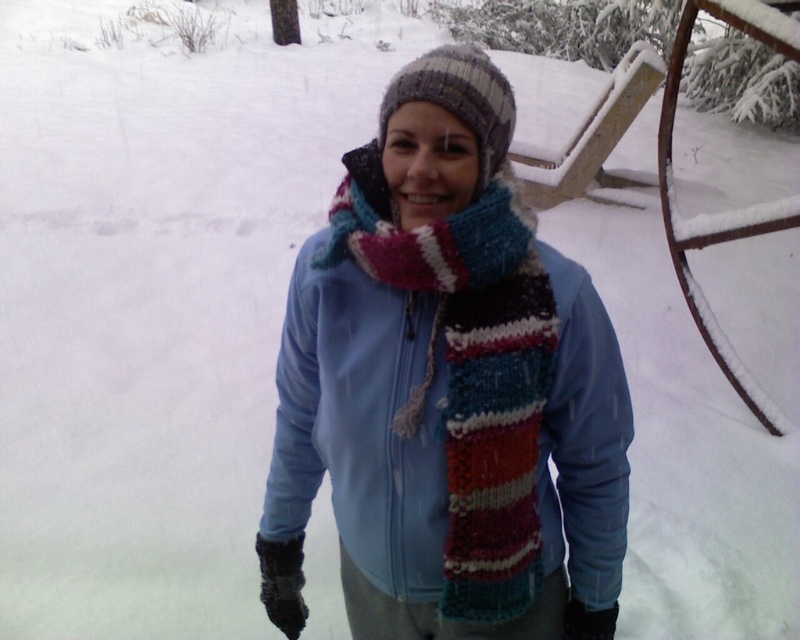
You are a fashion designer observing the person in the snowy scene. You want to create a new winter outfit that includes both the knitted wool scarf at center and the knitted woolen hat at center. Which item should you focus on first to ensure proper layering, considering their sizes?

The knitted wool scarf at center has a greater height compared to the knitted woolen hat at center, so you should focus on the knitted wool scarf at center first to ensure proper layering since it is taller and needs to be positioned correctly before the hat.

You are a fashion designer observing a person in winter attire. You notice the knitted wool scarf at center and the knitted woolen hat at center. Which item is positioned lower on the person?

The knitted wool scarf at center is located below the knitted woolen hat at center, so the scarf is positioned lower.